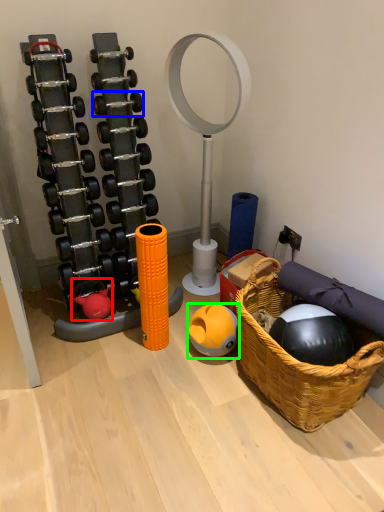
Question: Estimate the real-world distances between objects in this image. Which object is closer to toy (highlighted by a red box), dumbbell (highlighted by a blue box) or ball (highlighted by a green box)?

Choices:
 (A) dumbbell
 (B) ball

Answer: (B)